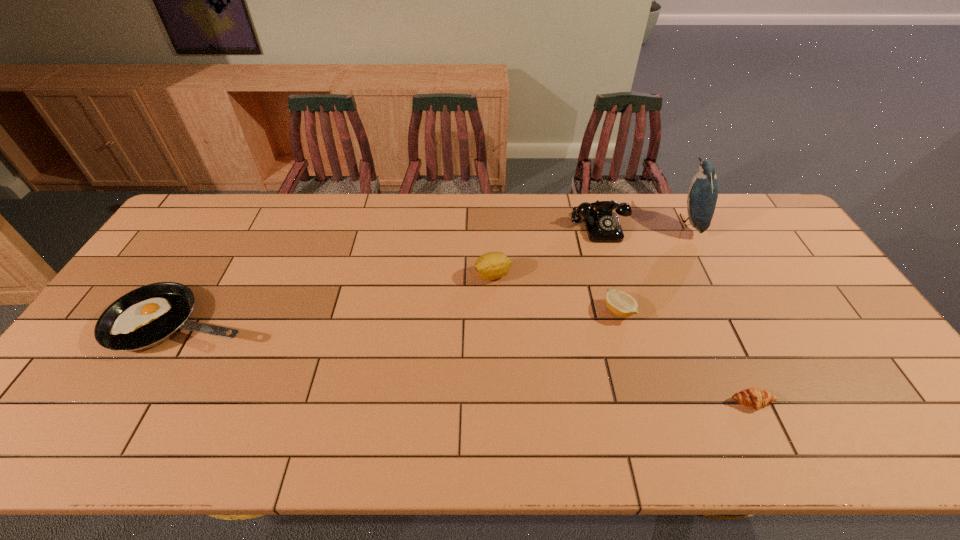
Find the location of `telephone at the far edge`. telephone at the far edge is located at coordinates (602, 224).

Where is `object that is at the left edge`? This screenshot has width=960, height=540. object that is at the left edge is located at coordinates (145, 317).

You are a GUI agent. You are given a task and a screenshot of the screen. Output one action in this format:
    pyautogui.click(x=<x>, y=<y>)
    Task: Click on the vacant space at the far edge of the desktop
    The width and height of the screenshot is (960, 540).
    Given the screenshot: What is the action you would take?
    pyautogui.click(x=507, y=198)

At what (x,y) coordinates should I click in order to perform the action: click on free space at the near edge of the desktop. Please return your answer as a coordinate pair (x, y). The height and width of the screenshot is (540, 960). Looking at the image, I should click on (605, 453).

At what (x,y) coordinates should I click in order to perform the action: click on vacant region at the right edge of the desktop. Please return your answer as a coordinate pair (x, y). This screenshot has width=960, height=540. Looking at the image, I should click on (822, 339).

Identify the location of vacant area that lies between the frying pan and the shortest object. (468, 362).

The image size is (960, 540). What are the coordinates of `free spot between the nearer lemon and the shortest object` in the screenshot? It's located at (685, 356).

Where is `free spot between the bird and the farther lemon`? This screenshot has width=960, height=540. free spot between the bird and the farther lemon is located at coordinates (591, 248).

Identify the location of vacant space in between the shorter lemon and the bird. (654, 266).

At what (x,y) coordinates should I click in order to perform the action: click on free space that is in between the right lemon and the telephone. Please return your answer as a coordinate pair (x, y). The image size is (960, 540). Looking at the image, I should click on click(x=610, y=269).